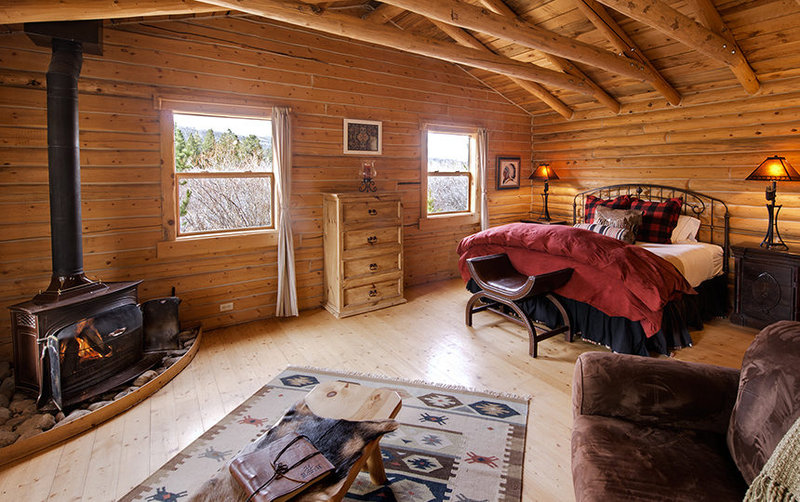
The width and height of the screenshot is (800, 502). Identify the location of pillows. (686, 238), (625, 220), (653, 221), (612, 203), (606, 231).